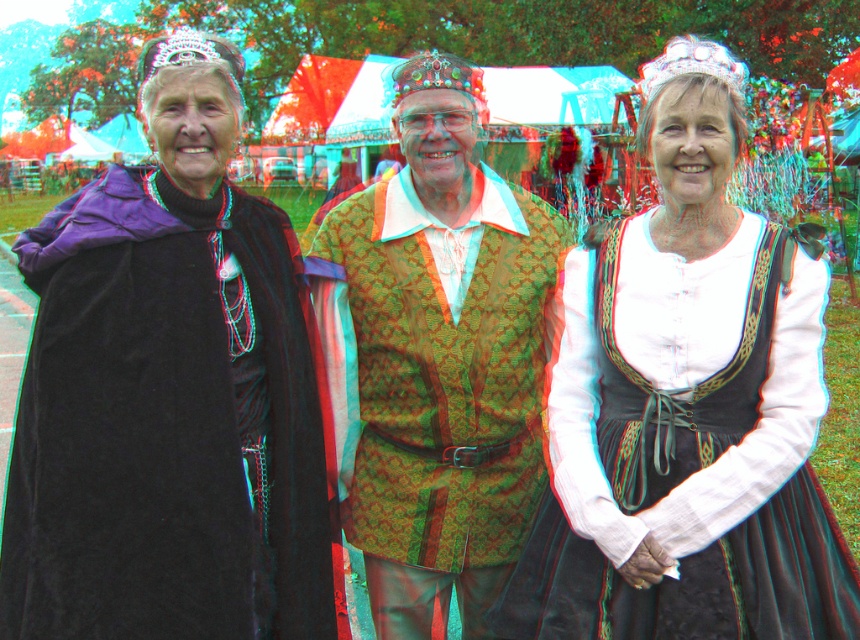
Question: Which object appears farthest from the camera in this image?

Choices:
 (A) velvet black dress at center
 (B) velvet black cape at left
 (C) green textured vest at center

Answer: (C)

Question: Does velvet black dress at center appear on the right side of green textured vest at center?

Choices:
 (A) yes
 (B) no

Answer: (A)

Question: Considering the real-world distances, which object is farthest from the green textured vest at center?

Choices:
 (A) velvet black cape at left
 (B) velvet black dress at center

Answer: (B)

Question: Observing the image, what is the correct spatial positioning of velvet black dress at center in reference to green textured vest at center?

Choices:
 (A) left
 (B) right

Answer: (B)

Question: Is velvet black dress at center to the right of green textured vest at center from the viewer's perspective?

Choices:
 (A) yes
 (B) no

Answer: (A)

Question: Which of the following is the closest to the observer?

Choices:
 (A) green textured vest at center
 (B) velvet black cape at left

Answer: (B)